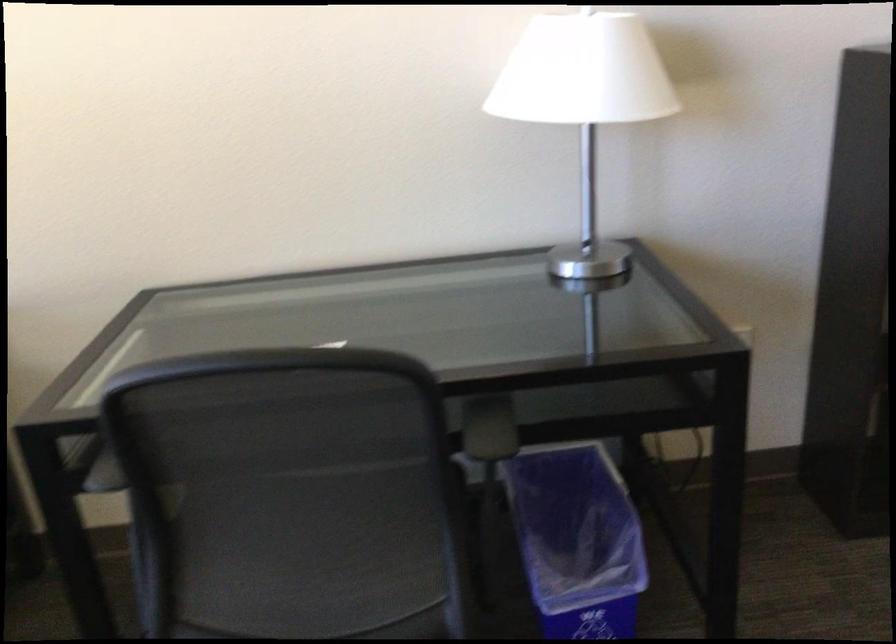
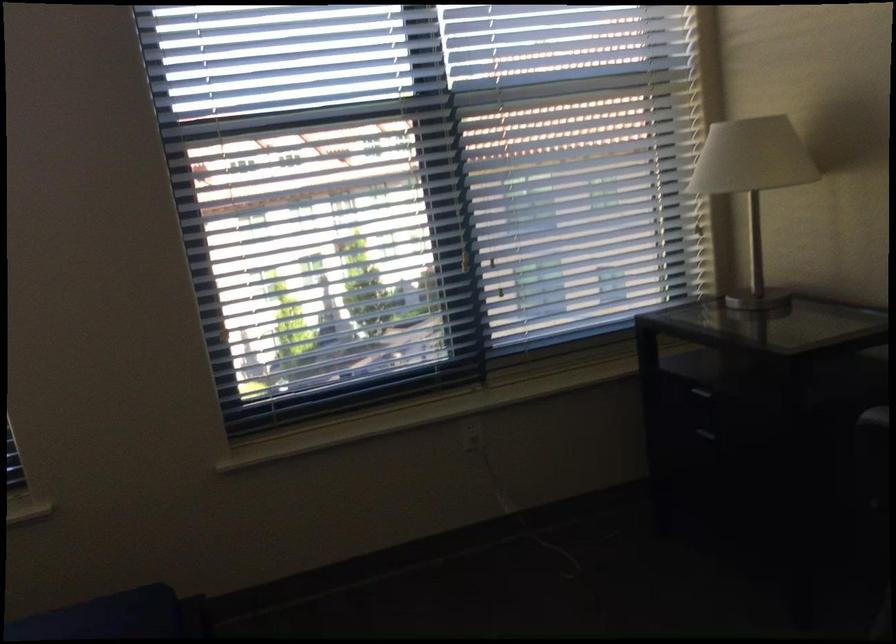
Question: The images are taken continuously from a first-person perspective. In which direction is your viewpoint rotating?

Choices:
 (A) Left
 (B) Right
 (C) Up
 (D) Down

Answer: (A)